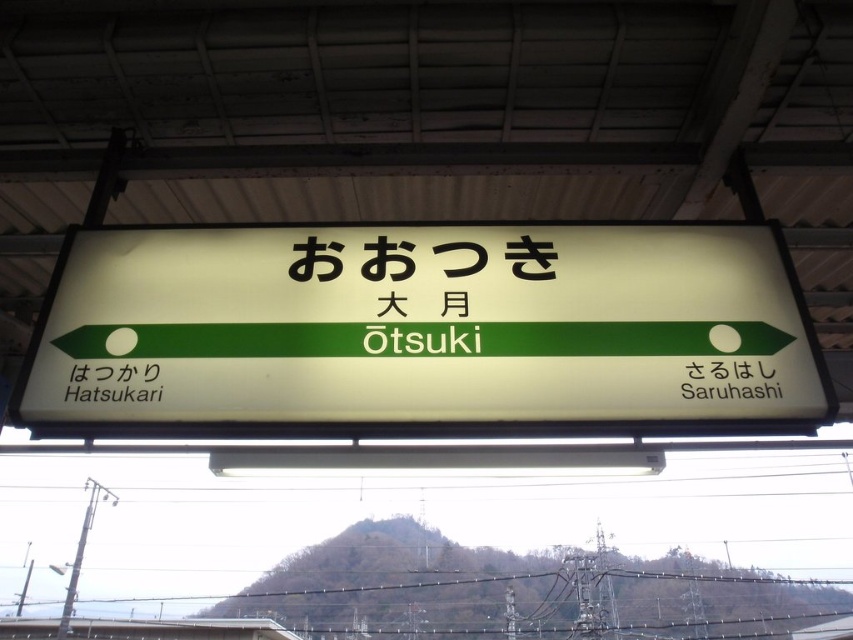
You are at a train station and need to read the station name displayed on the white plastic sign at center and the black plastic sign at upper center. According to the scene, which sign is positioned higher?

The white plastic sign at center is above the black plastic sign at upper center, so the white plastic sign at center is positioned higher.

Please look at the station signboard. There is a white paper at lower left located at point [113,381]. If you are standing directly in front of the signboard, which direction should you move to reach the white paper at lower left?

The white paper at lower left is located at point [113,381], so you should move to the lower left direction to reach it.

You are a traveler at the station and want to check the schedule written on the white paper at lower left and the black plastic sign at upper center. Which object is positioned more to the left?

The white paper at lower left is positioned more to the left than the black plastic sign at upper center.